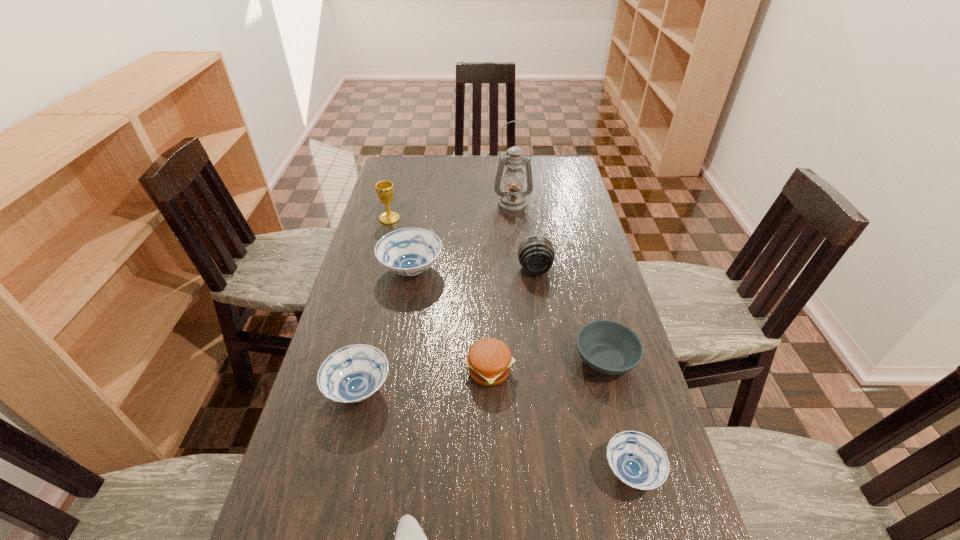
What are the coordinates of `gray soup bowl` in the screenshot? It's located at (609, 347).

Locate an element on the screen. Image resolution: width=960 pixels, height=540 pixels. the rightmost blue soup bowl is located at coordinates (636, 459).

You are a GUI agent. You are given a task and a screenshot of the screen. Output one action in this format:
    pyautogui.click(x=<x>, y=<y>)
    Task: Click on the smallest blue soup bowl
    
    Given the screenshot: What is the action you would take?
    pyautogui.click(x=636, y=459)

Identify the location of blank area located on the front of the tallest object. This screenshot has height=540, width=960. (515, 225).

Where is `free space located 0.330m on the right of the gold chalice`? The image size is (960, 540). free space located 0.330m on the right of the gold chalice is located at coordinates (488, 219).

The image size is (960, 540). I want to click on free space located at the front element of the telephoto lens, so click(539, 298).

The height and width of the screenshot is (540, 960). Identify the location of vacant space positioned 0.320m on the right of the tallest soup bowl. (541, 270).

At what (x,y) coordinates should I click in order to perform the action: click on free space located 0.200m on the right of the hamburger. Please return your answer as a coordinate pair (x, y). The height and width of the screenshot is (540, 960). Looking at the image, I should click on (592, 370).

This screenshot has width=960, height=540. I want to click on vacant space located on the right of the second tallest soup bowl, so pyautogui.click(x=492, y=390).

Identify the location of vacant space positioned 0.290m on the front of the gray soup bowl. The image size is (960, 540). (644, 508).